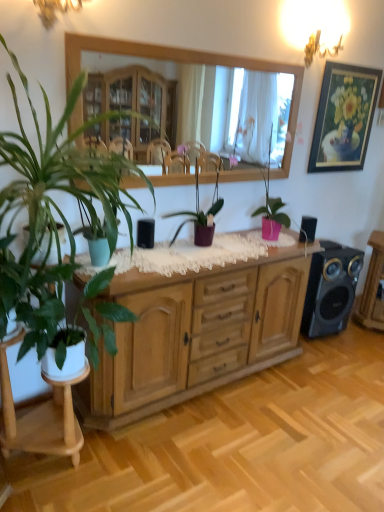
This screenshot has height=512, width=384. I want to click on vacant region under white lace cloth at center (from a real-world perspective), so click(210, 254).